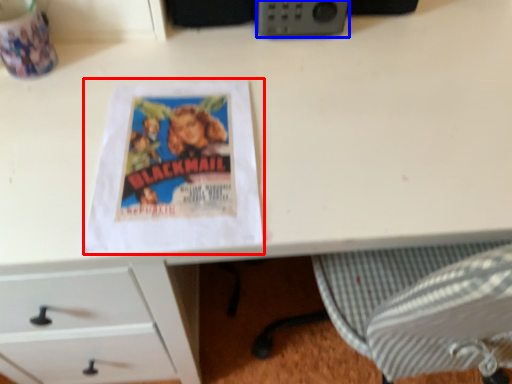
Question: Which of the following is the closest to the observer, paperback book (highlighted by a red box) or gadget (highlighted by a blue box)?

Choices:
 (A) paperback book
 (B) gadget

Answer: (A)